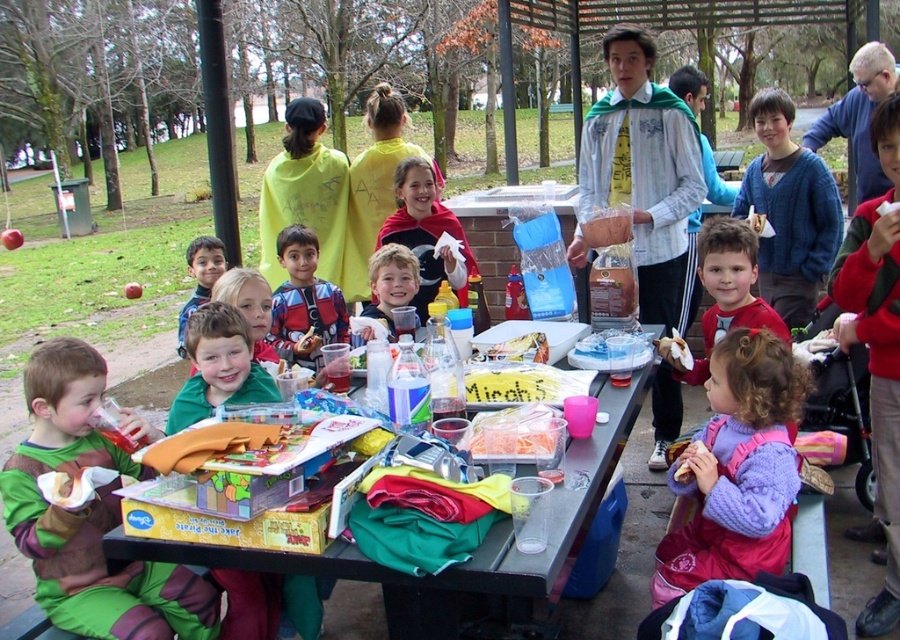
Based on the photo, is the position of green jersey at lower left less distant than that of matte red shirt at center?

Yes, green jersey at lower left is in front of matte red shirt at center.

Between green jersey at lower left and matte red shirt at center, which one appears on the right side from the viewer's perspective?

green jersey at lower left is more to the right.

Does point (220, 308) come behind point (299, 225)?

No.

What are the coordinates of `green jersey at lower left` in the screenshot? It's located at (218, 365).

Which is in front, point (702, 509) or point (606, 401)?

Positioned in front is point (606, 401).

Can you confirm if purple fleece sweater at lower right is positioned above wooden picnic table at center?

No, purple fleece sweater at lower right is not above wooden picnic table at center.

Is point (780, 424) in front of point (536, 595)?

No, it is not.

At what (x,y) coordinates should I click in order to perform the action: click on purple fleece sweater at lower right. Please return your answer as a coordinate pair (x, y). This screenshot has height=640, width=900. Looking at the image, I should click on (738, 468).

Between point (195, 552) and point (500, 420), which one is positioned in front?

Point (195, 552) is in front.

Who is more forward, (120, 547) or (474, 419)?

Positioned in front is point (120, 547).

The image size is (900, 640). I want to click on wooden picnic table at center, so click(x=464, y=563).